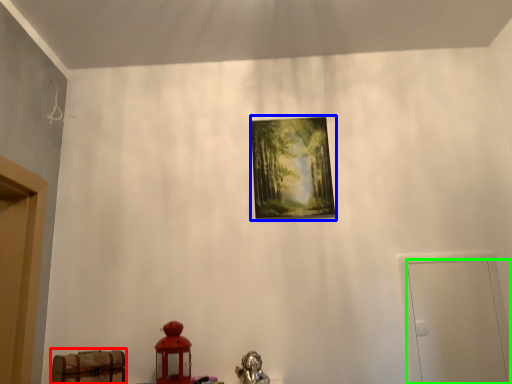
Question: Which object is positioned closest to furniture (highlighted by a red box)? Select from picture frame (highlighted by a blue box) and door (highlighted by a green box).

Choices:
 (A) picture frame
 (B) door

Answer: (A)